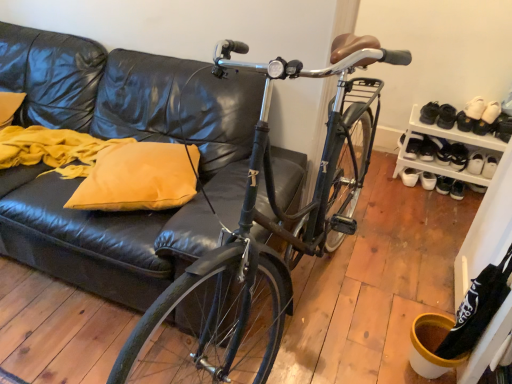
Question: Is white leather shoe at lower right, which is the 9th footwear from left to right, positioned far away from white leather shoe at right, arranged as the 1th shoe when viewed from the back?

Choices:
 (A) no
 (B) yes

Answer: (A)

Question: Does white leather shoe at lower right, positioned as the 1th footwear in right-to-left order, have a lesser width compared to white leather shoe at right, the 2th shoe viewed from the right?

Choices:
 (A) yes
 (B) no

Answer: (B)

Question: Is white leather shoe at lower right, which is the 9th footwear from left to right, positioned beyond the bounds of white leather shoe at right, marked as the first shoe in a left-to-right arrangement?

Choices:
 (A) no
 (B) yes

Answer: (B)

Question: Can you confirm if white leather shoe at lower right, positioned as the 1th footwear in right-to-left order, is bigger than white leather shoe at right, the 2th shoe viewed from the right?

Choices:
 (A) yes
 (B) no

Answer: (B)

Question: Can you confirm if white leather shoe at lower right, positioned as the 1th footwear in right-to-left order, is smaller than white leather shoe at right, which ranks as the 2th shoe in front-to-back order?

Choices:
 (A) no
 (B) yes

Answer: (B)

Question: Would you say white leather shoe at lower right, positioned as the 1th footwear in right-to-left order, is inside or outside white plastic shoe rack at right?

Choices:
 (A) outside
 (B) inside

Answer: (B)

Question: From a real-world perspective, is white leather shoe at lower right, which is the 9th footwear from left to right, positioned above or below white plastic shoe rack at right?

Choices:
 (A) below
 (B) above

Answer: (A)

Question: Is white leather shoe at lower right, positioned as the 1th footwear in right-to-left order, wider or thinner than white plastic shoe rack at right?

Choices:
 (A) thin
 (B) wide

Answer: (A)

Question: Visually, is white leather shoe at lower right, which is the 9th footwear from left to right, positioned to the left or to the right of white plastic shoe rack at right?

Choices:
 (A) left
 (B) right

Answer: (B)

Question: Is yellow fabric pillow at left spatially inside shiny black bicycle at center, or outside of it?

Choices:
 (A) outside
 (B) inside

Answer: (A)

Question: Is yellow fabric pillow at left wider or thinner than shiny black bicycle at center?

Choices:
 (A) thin
 (B) wide

Answer: (A)

Question: Considering the relative positions of yellow fabric pillow at left and shiny black bicycle at center in the image provided, is yellow fabric pillow at left to the left or to the right of shiny black bicycle at center?

Choices:
 (A) left
 (B) right

Answer: (A)

Question: Is yellow fabric pillow at left bigger or smaller than shiny black bicycle at center?

Choices:
 (A) big
 (B) small

Answer: (B)

Question: From a real-world perspective, is white matte sneakers at lower right, which ranks as the eighth footwear in right-to-left order, positioned above or below white leather shoe at upper right, the second shoe positioned from the left?

Choices:
 (A) above
 (B) below

Answer: (B)

Question: From the image's perspective, is white matte sneakers at lower right, which ranks as the eighth footwear in right-to-left order, located above or below white leather shoe at upper right, marked as the first shoe in a right-to-left arrangement?

Choices:
 (A) below
 (B) above

Answer: (A)